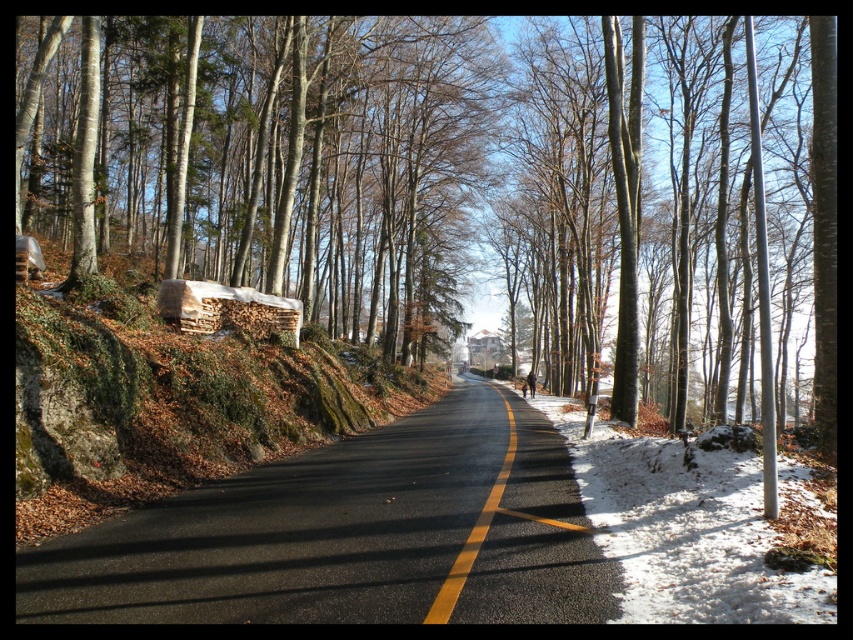
Is point (90, 362) positioned before point (477, 538)?

No.

The width and height of the screenshot is (853, 640). Find the location of `brown woodpile at left`. brown woodpile at left is located at coordinates (177, 403).

You are a GUI agent. You are given a task and a screenshot of the screen. Output one action in this format:
    pyautogui.click(x=<x>, y=<y>)
    Task: Click on the brown woodpile at left
    This screenshot has height=640, width=853.
    Given the screenshot: What is the action you would take?
    pyautogui.click(x=177, y=403)

Based on the photo, who is positioned more to the left, brown woodpile at center or yellow asphalt road at center?

brown woodpile at center

Between point (144, 26) and point (476, 547), which one is positioned in front?

Positioned in front is point (476, 547).

At what (x,y) coordinates should I click in order to perform the action: click on brown woodpile at center. Please return your answer as a coordinate pair (x, y). The width and height of the screenshot is (853, 640). Looking at the image, I should click on (462, 177).

Where is `brown woodpile at center`? This screenshot has width=853, height=640. brown woodpile at center is located at coordinates (462, 177).

Who is more distant from viewer, (x=412, y=72) or (x=105, y=307)?

Positioned behind is point (x=412, y=72).

Is smooth bark tree at left below brown woodpile at left?

No.

The width and height of the screenshot is (853, 640). I want to click on smooth bark tree at left, so click(280, 157).

The image size is (853, 640). I want to click on smooth bark tree at left, so click(280, 157).